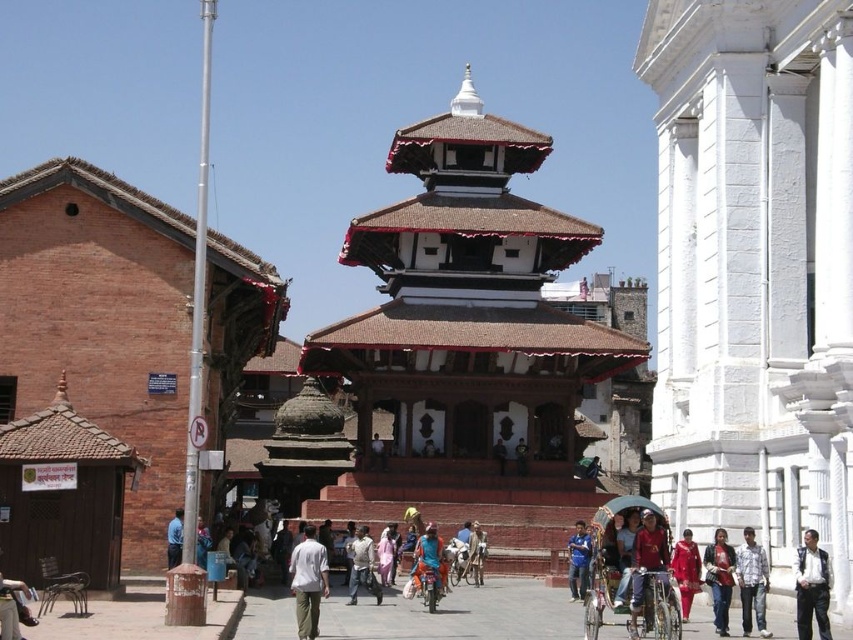
Question: Which point is closer to the camera taking this photo?

Choices:
 (A) (680, 563)
 (B) (720, 531)
 (C) (740, 586)

Answer: (C)

Question: Is leather jacket at lower right closer to the viewer compared to light brown fabric pants at center?

Choices:
 (A) no
 (B) yes

Answer: (B)

Question: Among these points, which one is farthest from the camera?

Choices:
 (A) (473, 563)
 (B) (675, 552)
 (C) (439, 573)

Answer: (A)

Question: Can you confirm if pink fabric dress at center is thinner than blue fabric shirt at center?

Choices:
 (A) yes
 (B) no

Answer: (A)

Question: Is leather jacket at lower right thinner than denim jacket at lower right?

Choices:
 (A) yes
 (B) no

Answer: (B)

Question: Which of the following is the farthest from the observer?

Choices:
 (A) (648, 540)
 (B) (16, 616)
 (C) (582, 529)

Answer: (C)